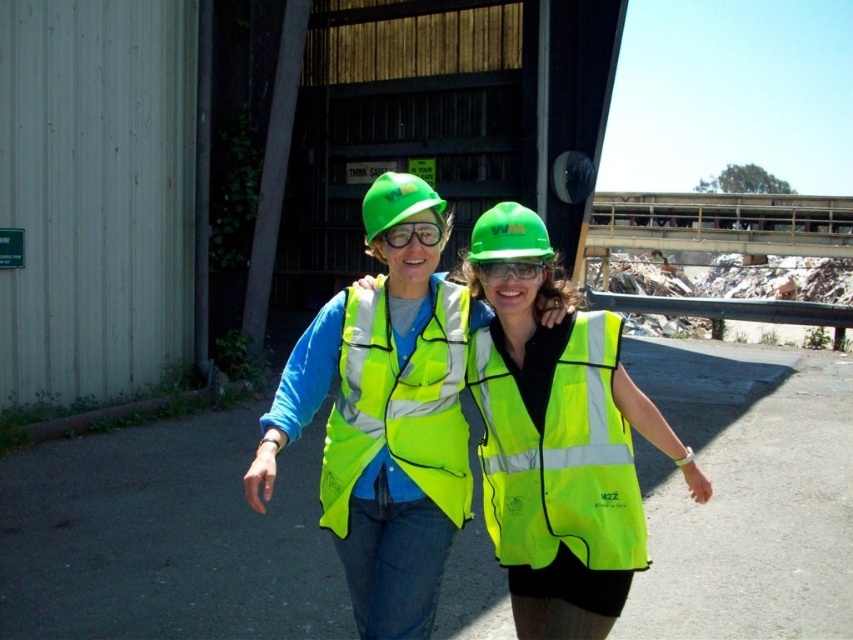
Describe the element at coordinates (508, 234) in the screenshot. I see `green matte hard hat at center` at that location.

Does green matte hard hat at center have a smaller size compared to green hard hat at center?

Yes, green matte hard hat at center is smaller than green hard hat at center.

Which is behind, point (543, 230) or point (387, 188)?

The point (543, 230) is behind.

Where is `green matte hard hat at center`? green matte hard hat at center is located at coordinates (508, 234).

Does high-visibility fabric safety vest at center have a larger size compared to matte green goggles at center?

Correct, high-visibility fabric safety vest at center is larger in size than matte green goggles at center.

Where is `high-visibility fabric safety vest at center`? This screenshot has width=853, height=640. high-visibility fabric safety vest at center is located at coordinates (561, 460).

I want to click on high-visibility fabric safety vest at center, so click(x=561, y=460).

Can you confirm if neon yellow reflective vest at center is positioned to the right of green matte hard hat at center?

No, neon yellow reflective vest at center is not to the right of green matte hard hat at center.

Can you confirm if neon yellow reflective vest at center is bigger than green matte hard hat at center?

No.

Is point (399, 276) positioned behind point (514, 246)?

Yes, it is behind point (514, 246).

Find the location of a particular element. neon yellow reflective vest at center is located at coordinates (384, 432).